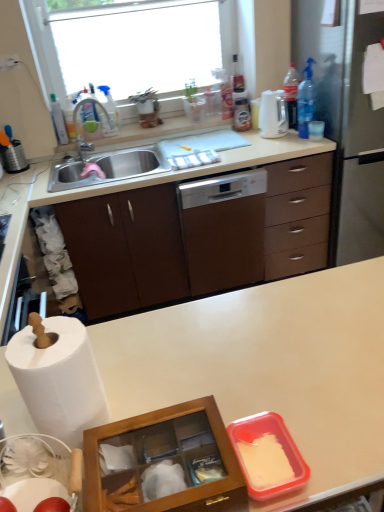
You are a GUI agent. You are given a task and a screenshot of the screen. Output one action in this format:
    pyautogui.click(x=<x>, y=<y>)
    Task: Click on the vacant area that is situated to the right of brushed metal grater at left
    The width and height of the screenshot is (384, 512).
    Given the screenshot: What is the action you would take?
    pyautogui.click(x=56, y=164)